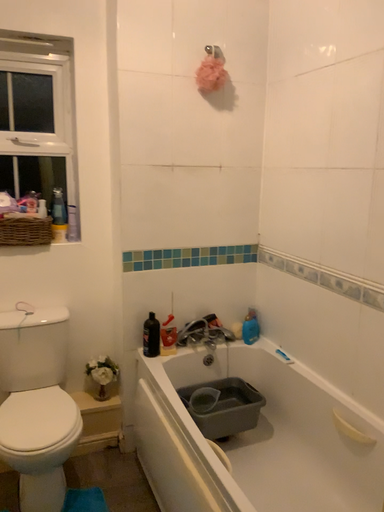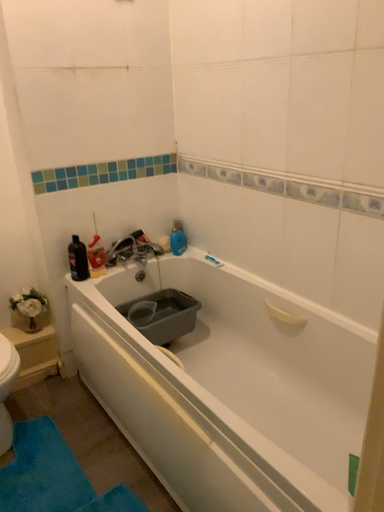
Question: Which way did the camera rotate in the video?

Choices:
 (A) rotated downward
 (B) rotated upward

Answer: (A)